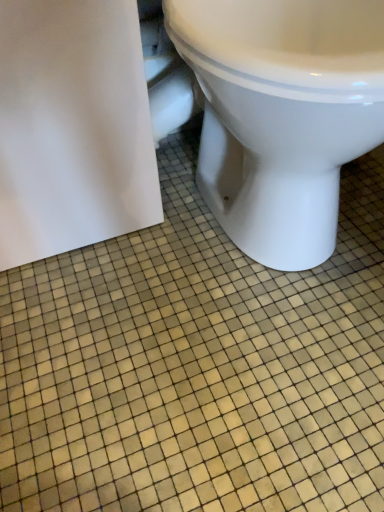
Question: Should I look upward or downward to see white glossy toilet at center?

Choices:
 (A) up
 (B) down

Answer: (A)